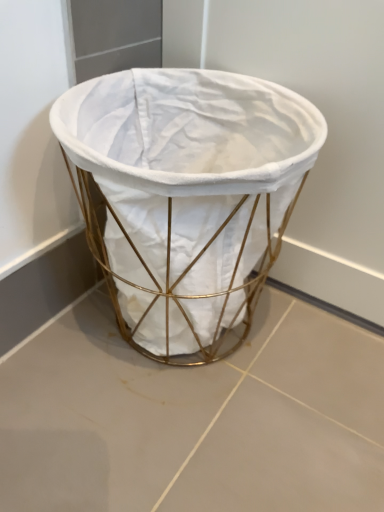
The width and height of the screenshot is (384, 512). Find the location of `gold wire mesh basket at center`. gold wire mesh basket at center is located at coordinates (187, 197).

The image size is (384, 512). Describe the element at coordinates (187, 197) in the screenshot. I see `gold wire mesh basket at center` at that location.

The width and height of the screenshot is (384, 512). Identify the location of gold wire mesh basket at center. (187, 197).